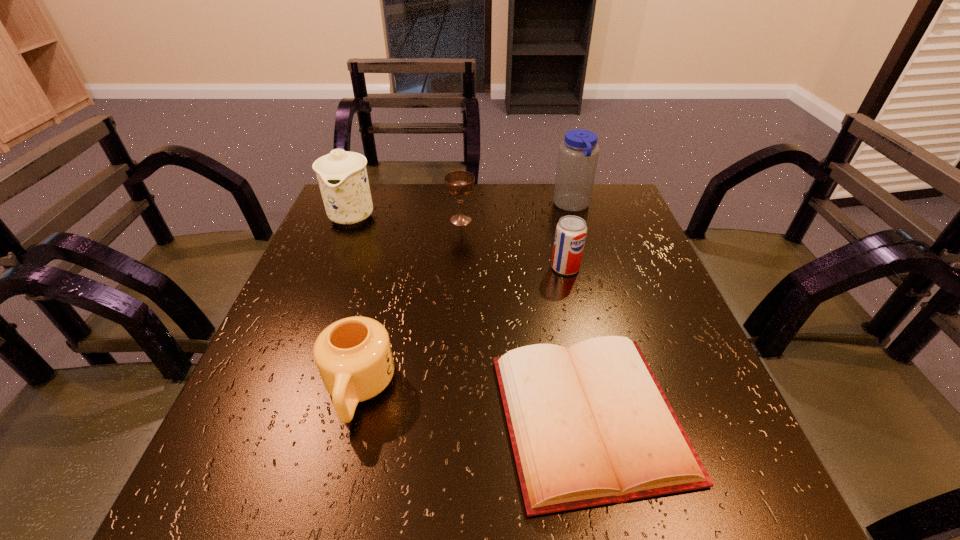
Locate an element on the screen. Image resolution: width=960 pixels, height=540 pixels. water bottle that is positioned at the right edge is located at coordinates (578, 154).

Find the location of `Bible that is at the right edge`. Bible that is at the right edge is located at coordinates (591, 425).

Image resolution: width=960 pixels, height=540 pixels. Identify the location of object that is at the far left corner. (342, 176).

I want to click on object at the far right corner, so click(578, 154).

Identify the location of object located at the near right corner. (591, 425).

Where is `vacant space at the far edge of the desktop`? vacant space at the far edge of the desktop is located at coordinates (392, 224).

In the image, there is a desktop. Where is `vacant space at the near edge`? The height and width of the screenshot is (540, 960). vacant space at the near edge is located at coordinates (361, 477).

Identify the location of free location at the left edge of the desktop. The image size is (960, 540). (350, 266).

Find the location of `vacant space at the right edge`. vacant space at the right edge is located at coordinates (697, 428).

In the image, there is a desktop. Identify the location of vacant space at the far left corner. (359, 225).